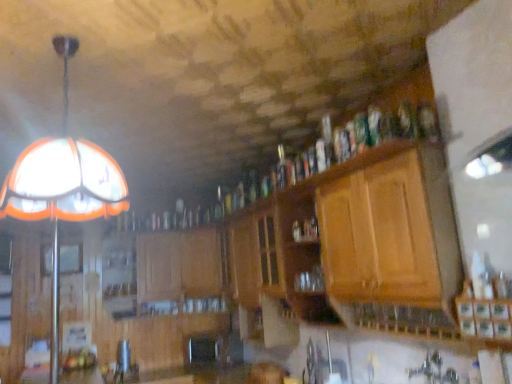
What do you see at coordinates (484, 317) in the screenshot?
I see `wooden cabinet at lower right` at bounding box center [484, 317].

Locate an element on the screen. This screenshot has width=512, height=384. wooden cabinet at lower right is located at coordinates (484, 317).

What is the approximate width of wooden cabinet at lower right?

wooden cabinet at lower right is 5.44 inches in width.

This screenshot has height=384, width=512. Identify the location of wooden cabinet at lower right. click(484, 317).